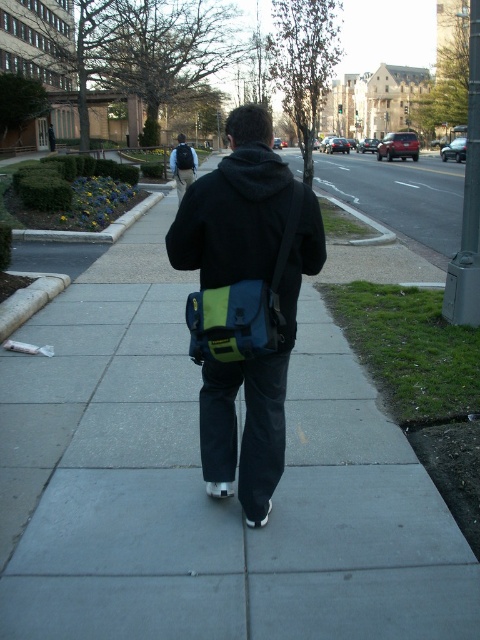
Does matte blue-green bag at center have a greater width compared to blue fabric bag at center?

No, matte blue-green bag at center is not wider than blue fabric bag at center.

Which is below, matte blue-green bag at center or blue fabric bag at center?

blue fabric bag at center

The width and height of the screenshot is (480, 640). What are the coordinates of `matte blue-green bag at center` in the screenshot? It's located at (245, 301).

Is point (206, 316) positioned behind point (192, 156)?

No, it is in front of (192, 156).

From the picture: Can you confirm if blue fabric bag at center is smaller than matte blue backpack at center?

Actually, blue fabric bag at center might be larger than matte blue backpack at center.

Between point (205, 332) and point (181, 156), which one is positioned behind?

Positioned behind is point (181, 156).

Find the location of a particular element. The width and height of the screenshot is (480, 640). blue fabric bag at center is located at coordinates (241, 308).

Is matte blue-green bag at center bigger than matte black backpack at upper center?

Incorrect, matte blue-green bag at center is not larger than matte black backpack at upper center.

Can you confirm if matte blue-green bag at center is positioned above matte black backpack at upper center?

Actually, matte blue-green bag at center is below matte black backpack at upper center.

Between point (249, 112) and point (179, 195), which one is positioned in front?

Point (249, 112)

Where is `matte blue-green bag at center`? Image resolution: width=480 pixels, height=640 pixels. matte blue-green bag at center is located at coordinates (245, 301).